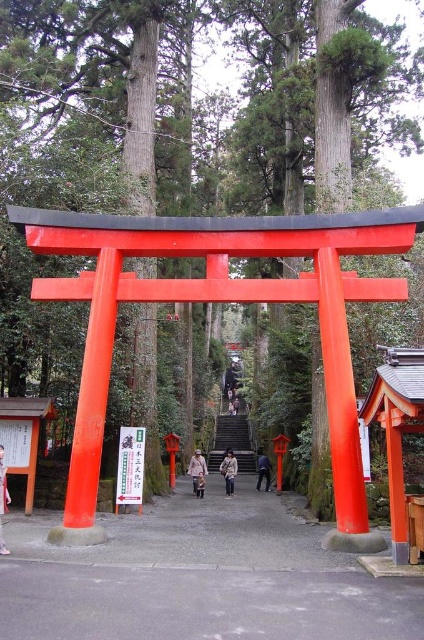
Does point (231, 474) lie in front of point (262, 449)?

Yes, point (231, 474) is closer to viewer.

Who is more distant from viewer, (226, 474) or (265, 490)?

The point (265, 490) is behind.

The image size is (424, 640). I want to click on beige fabric coat at center, so click(228, 472).

Which of these two, pink fabric coat at center or light brown leather coat at center, stands shorter?

light brown leather coat at center

Who is positioned more to the left, pink fabric coat at center or light brown leather coat at center?

Positioned to the left is pink fabric coat at center.

Is point (194, 474) less distant than point (198, 490)?

Yes, it is in front of point (198, 490).

This screenshot has height=640, width=424. What are the coordinates of `pink fabric coat at center` in the screenshot? It's located at (198, 472).

Does pink fabric coat at center appear over light brown leather jacket at lower left?

Incorrect, pink fabric coat at center is not positioned above light brown leather jacket at lower left.

Is pink fabric coat at center thinner than light brown leather jacket at lower left?

No, pink fabric coat at center is not thinner than light brown leather jacket at lower left.

The height and width of the screenshot is (640, 424). I want to click on pink fabric coat at center, so click(198, 472).

At what (x,y) coordinates should I click in order to perform the action: click on pink fabric coat at center. Please return your answer as a coordinate pair (x, y). The image size is (424, 640). Looking at the image, I should click on (198, 472).